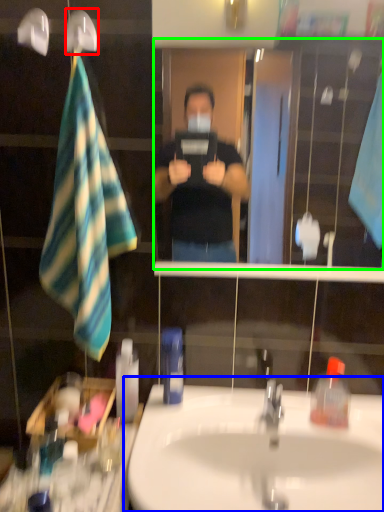
Question: Estimate the real-world distances between objects in this image. Which object is closer to shower (highlighted by a red box), sink (highlighted by a blue box) or mirror (highlighted by a green box)?

Choices:
 (A) sink
 (B) mirror

Answer: (A)